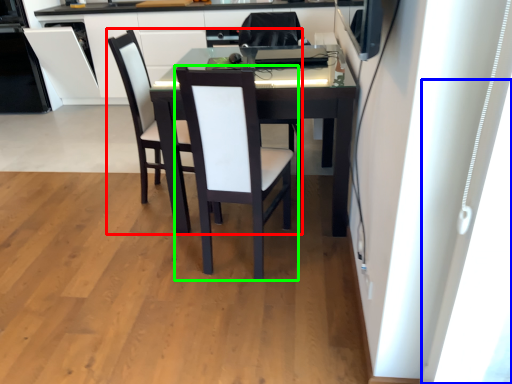
Question: Estimate the real-world distances between objects in this image. Which object is farther from chair (highlighted by a red box), window (highlighted by a blue box) or chair (highlighted by a green box)?

Choices:
 (A) window
 (B) chair

Answer: (A)